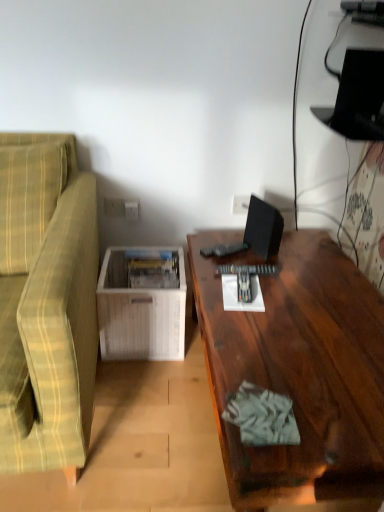
Question: Does green plaid fabric couch at left have a larger size compared to white wood magazine rack at lower left?

Choices:
 (A) no
 (B) yes

Answer: (B)

Question: Is green plaid fabric couch at left positioned far away from white wood magazine rack at lower left?

Choices:
 (A) no
 (B) yes

Answer: (A)

Question: Can you confirm if green plaid fabric couch at left is positioned to the left of white wood magazine rack at lower left?

Choices:
 (A) no
 (B) yes

Answer: (B)

Question: Is green plaid fabric couch at left oriented away from white wood magazine rack at lower left?

Choices:
 (A) yes
 (B) no

Answer: (B)

Question: Can you confirm if green plaid fabric couch at left is shorter than white wood magazine rack at lower left?

Choices:
 (A) no
 (B) yes

Answer: (A)

Question: From a real-world perspective, is green plaid fabric couch at left physically located above or below white plastic electric outlet at center, the 2th electric outlet viewed from the right?

Choices:
 (A) above
 (B) below

Answer: (B)

Question: Visually, is green plaid fabric couch at left positioned to the left or to the right of white plastic electric outlet at center, acting as the 2th electric outlet starting from the back?

Choices:
 (A) left
 (B) right

Answer: (A)

Question: Considering the positions of green plaid fabric couch at left and white plastic electric outlet at center, marked as the first electric outlet in a front-to-back arrangement, in the image, is green plaid fabric couch at left wider or thinner than white plastic electric outlet at center, marked as the first electric outlet in a front-to-back arrangement,?

Choices:
 (A) thin
 (B) wide

Answer: (B)

Question: From their relative heights in the image, would you say green plaid fabric couch at left is taller or shorter than white plastic electric outlet at center, marked as the first electric outlet in a front-to-back arrangement?

Choices:
 (A) tall
 (B) short

Answer: (A)

Question: Does point (253, 219) appear closer or farther from the camera than point (112, 326)?

Choices:
 (A) farther
 (B) closer

Answer: (B)

Question: From the image's perspective, relative to white wood magazine rack at lower left, is black matte computer monitor at upper right above or below?

Choices:
 (A) above
 (B) below

Answer: (A)

Question: Which is correct: black matte computer monitor at upper right is inside white wood magazine rack at lower left, or outside of it?

Choices:
 (A) outside
 (B) inside

Answer: (A)

Question: Relative to white wood magazine rack at lower left, is black matte computer monitor at upper right in front or behind?

Choices:
 (A) behind
 (B) front

Answer: (B)

Question: Is black matte computer monitor at upper right bigger or smaller than dark wood desk at right?

Choices:
 (A) small
 (B) big

Answer: (A)

Question: Is black matte computer monitor at upper right in front of or behind dark wood desk at right in the image?

Choices:
 (A) behind
 (B) front

Answer: (A)